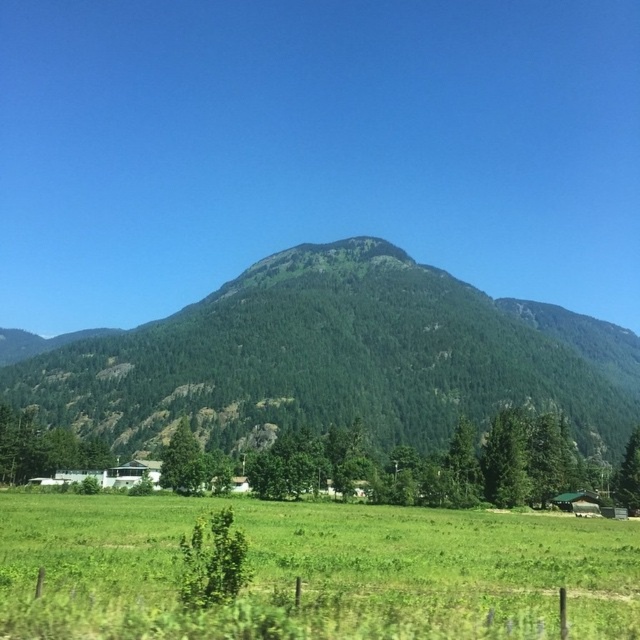
Is point (304, 410) in front of point (464, 476)?

No, (304, 410) is further to viewer.

This screenshot has width=640, height=640. What do you see at coordinates (337, 358) in the screenshot?
I see `green textured mountain at center` at bounding box center [337, 358].

Does point (268, 440) lie behind point (477, 477)?

Yes, it is behind point (477, 477).

Identify the location of green textured mountain at center. (337, 358).

Is green grass at lower center further to camera compared to green leafy tree at lower left?

No, green grass at lower center is in front of green leafy tree at lower left.

You are a GUI agent. You are given a task and a screenshot of the screen. Output one action in this format:
    pyautogui.click(x=<x>, y=<y>)
    Task: Click on the green grass at lower center
    Image resolution: width=640 pixels, height=640 pixels.
    Given the screenshot: What is the action you would take?
    pyautogui.click(x=314, y=572)

Is green leafy tree at center further to camera compared to green matte tree at lower right?

No, green leafy tree at center is closer to the viewer.

Which is behind, point (461, 433) or point (627, 508)?

The point (461, 433) is behind.

Where is `green leafy tree at center`? This screenshot has height=640, width=640. green leafy tree at center is located at coordinates (461, 467).